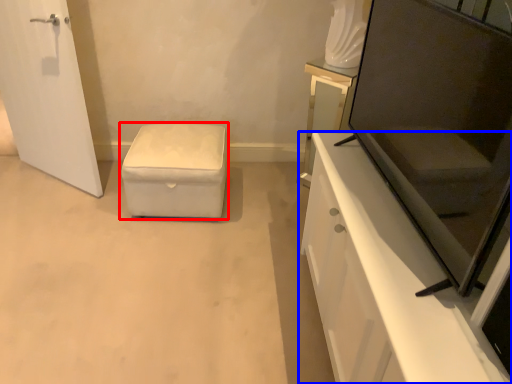
Question: Which point is closer to the camera, furniture (highlighted by a red box) or cabinetry (highlighted by a blue box)?

Choices:
 (A) furniture
 (B) cabinetry

Answer: (B)